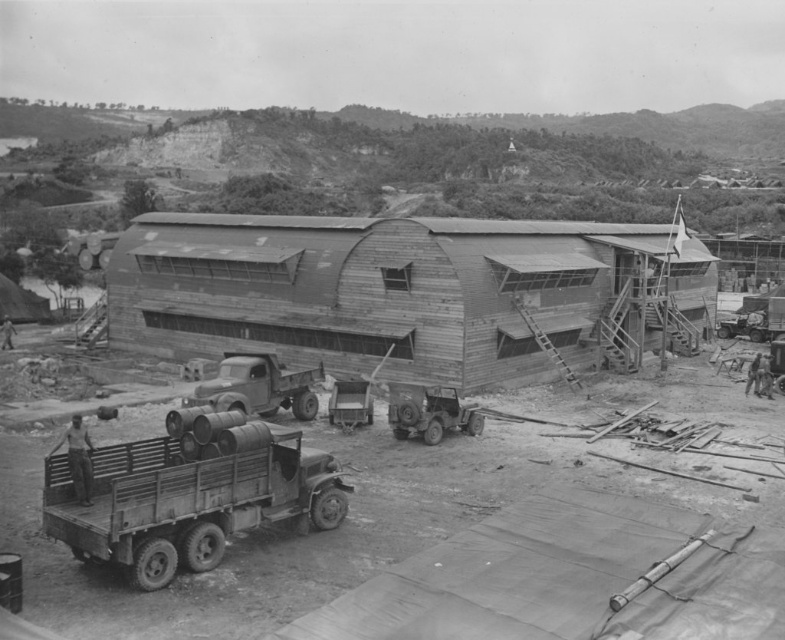
Question: Which object is the closest to the wooden hut at center?

Choices:
 (A) matte gray truck at center
 (B) rusty metal truck at lower left

Answer: (A)

Question: Considering the real-world distances, which object is closest to the rusty metal truck at lower left?

Choices:
 (A) wooden hut at center
 (B) matte gray truck at center

Answer: (B)

Question: Can you confirm if rusty metal truck at lower left is positioned above matte gray truck at center?

Choices:
 (A) yes
 (B) no

Answer: (B)

Question: Does wooden hut at center have a larger size compared to rusty metal truck at lower left?

Choices:
 (A) no
 (B) yes

Answer: (B)

Question: Can you confirm if wooden hut at center is positioned below matte gray truck at center?

Choices:
 (A) yes
 (B) no

Answer: (B)

Question: Which point is farther to the camera?

Choices:
 (A) rusty metal truck at lower left
 (B) wooden hut at center

Answer: (B)